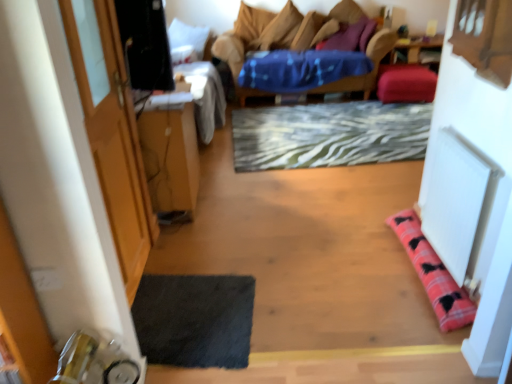
The image size is (512, 384). Identify the location of spots to the right of wooden door at left. (203, 288).